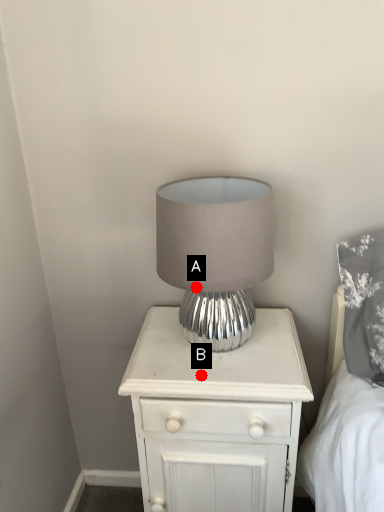
Question: Two points are circled on the image, labeled by A and B beside each circle. Which point is farther to the camera?

Choices:
 (A) A is further
 (B) B is further

Answer: (B)